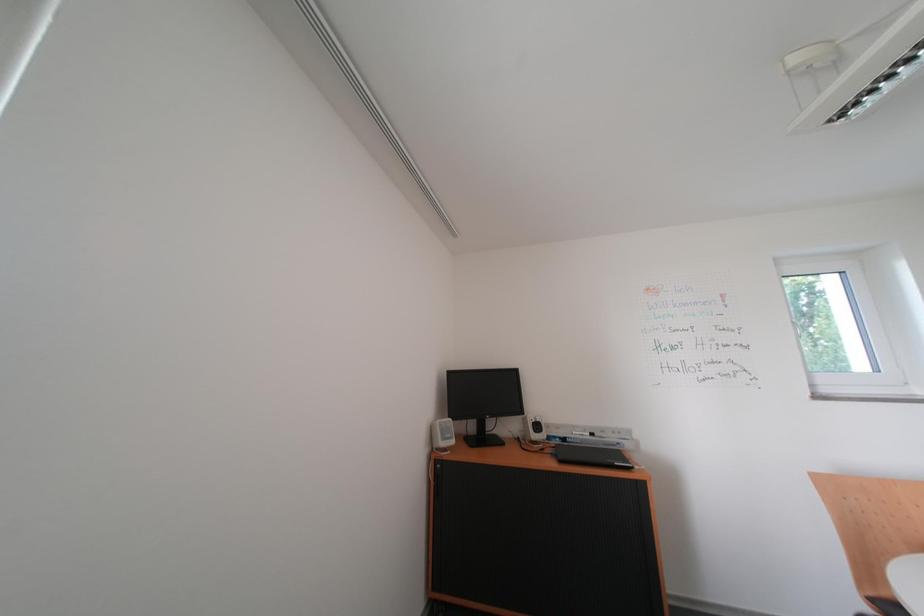
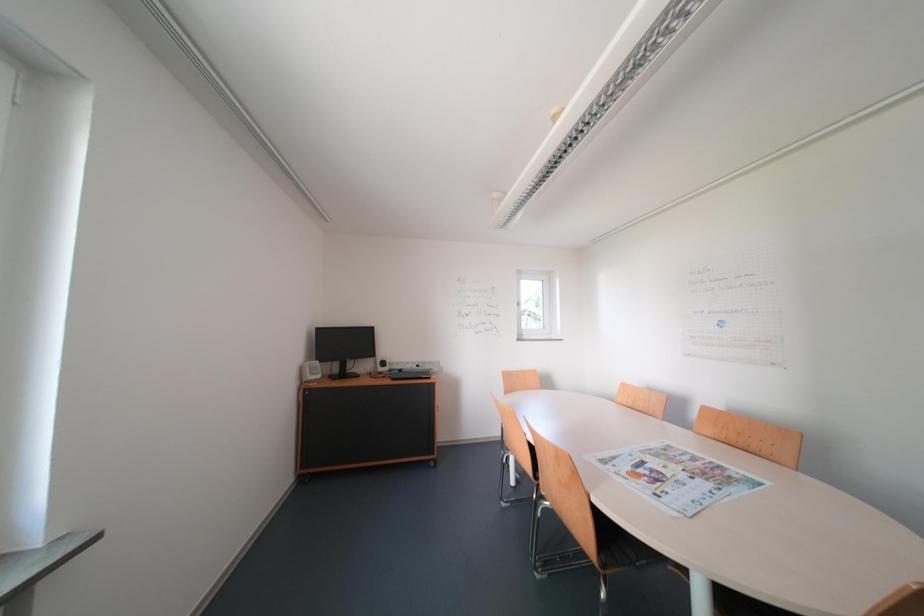
Question: Based on the continuous images, in which direction is the camera rotating? Reply with the corresponding letter.

Choices:
 (A) Left
 (B) Right
 (C) Up
 (D) Down

Answer: (B)